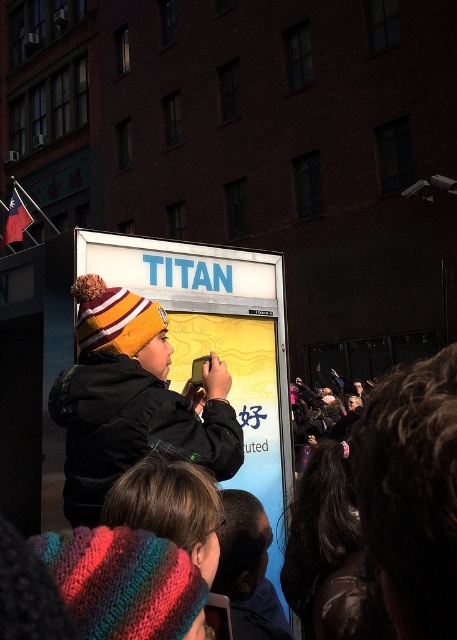
Question: Among these points, which one is nearest to the camera?

Choices:
 (A) (365, 445)
 (B) (117, 387)

Answer: (A)

Question: Is knitted woolen hat at center above dark brown hair at center?

Choices:
 (A) yes
 (B) no

Answer: (A)

Question: Is knitted woolen hat at center to the left of dark brown hair at center from the viewer's perspective?

Choices:
 (A) no
 (B) yes

Answer: (B)

Question: Does knitted woolen hat at center have a greater width compared to dark brown hair at center?

Choices:
 (A) yes
 (B) no

Answer: (A)